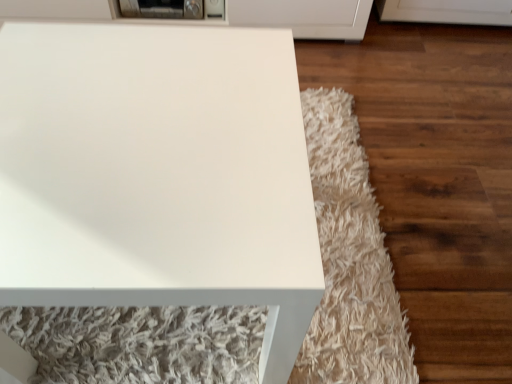
Where is `free spot to the right of white glossy table at center`? free spot to the right of white glossy table at center is located at coordinates (355, 255).